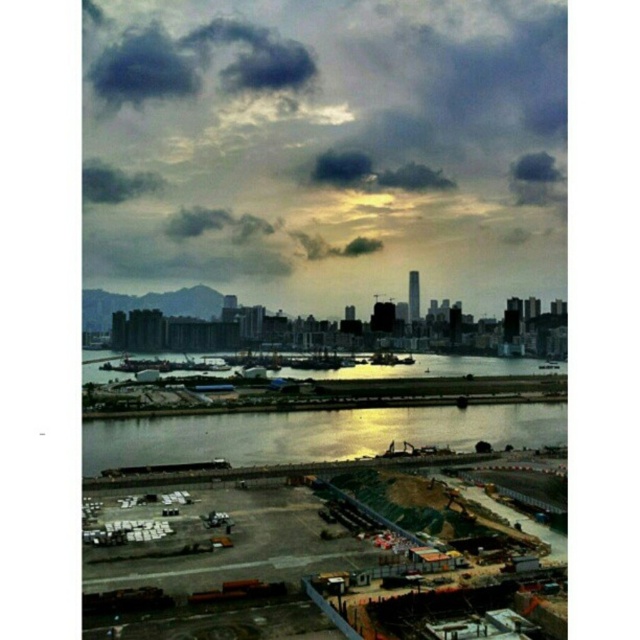
Who is more forward, (392, 257) or (333, 436)?

Point (333, 436) is in front.

Is dark gray cloud at upper center smaller than reflective glass waterway at center?

No.

Measure the distance between dark gray cloud at upper center and camera.

A distance of 2.66 meters exists between dark gray cloud at upper center and camera.

Locate an element on the screen. dark gray cloud at upper center is located at coordinates (328, 138).

Can you confirm if reflective glass waterway at center is positioned above dark gray cloud at upper left?

Actually, reflective glass waterway at center is below dark gray cloud at upper left.

Between reflective glass waterway at center and dark gray cloud at upper left, which one has less height?

reflective glass waterway at center

At what (x,y) coordinates should I click in order to perform the action: click on reflective glass waterway at center. Please return your answer as a coordinate pair (x, y). Image resolution: width=640 pixels, height=640 pixels. Looking at the image, I should click on (314, 435).

At what (x,y) coordinates should I click in order to perform the action: click on dark gray cloud at upper center. Please return your answer as a coordinate pair (x, y). Looking at the image, I should click on (328, 138).

Between dark gray cloud at upper center and dark gray cloud at upper left, which one has less height?

Standing shorter between the two is dark gray cloud at upper left.

Is point (170, 259) positioned behind point (92, 192)?

Yes, it is behind point (92, 192).

Where is `dark gray cloud at upper center`? dark gray cloud at upper center is located at coordinates (328, 138).